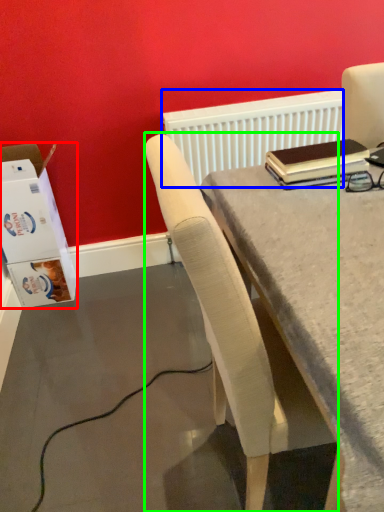
Question: Based on their relative distances, which object is nearer to box (highlighted by a red box)? Choose from radiator (highlighted by a blue box) and chair (highlighted by a green box).

Choices:
 (A) radiator
 (B) chair

Answer: (A)